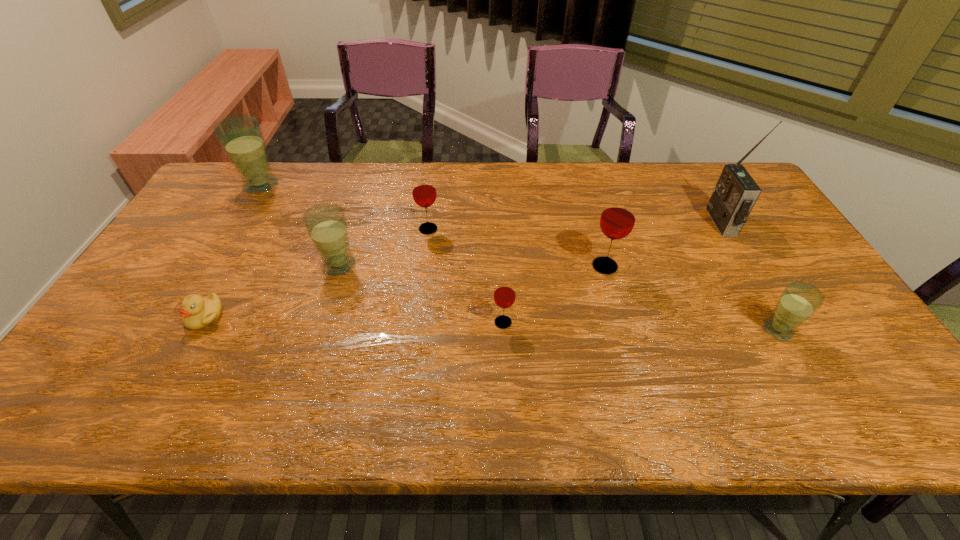
Locate an element on the screen. This screenshot has width=960, height=540. vacant space at the far edge of the desktop is located at coordinates (545, 166).

This screenshot has height=540, width=960. In the image, there is a desktop. In order to click on free region at the near edge in this screenshot , I will do `click(691, 405)`.

Image resolution: width=960 pixels, height=540 pixels. I want to click on vacant position at the left edge of the desktop, so click(x=148, y=355).

The width and height of the screenshot is (960, 540). In the image, there is a desktop. Find the location of `free space at the near right corner`. free space at the near right corner is located at coordinates (910, 421).

Find the location of a particular element. vacant area that lies between the smallest blue glass and the farthest blue glass is located at coordinates [x=519, y=258].

Locate an element on the screen. This screenshot has width=960, height=540. free spot between the farthest blue glass and the tallest object is located at coordinates (492, 204).

At what (x,y) coordinates should I click in order to perform the action: click on free area in between the farthest blue glass and the shortest object. Please return your answer as a coordinate pair (x, y). This screenshot has width=960, height=540. Looking at the image, I should click on (233, 251).

You are a GUI agent. You are given a task and a screenshot of the screen. Output one action in this format:
    pyautogui.click(x=<x>, y=<y>)
    Task: Click on the free area in between the fourth object from right to left and the shortest object
    
    Given the screenshot: What is the action you would take?
    coord(354,319)

Image resolution: width=960 pixels, height=540 pixels. I want to click on vacant area between the fifth object from right to left and the radio receiver, so click(575, 226).

The width and height of the screenshot is (960, 540). In order to click on free space between the duckling and the fifth object from left to right in this screenshot , I will do `click(354, 319)`.